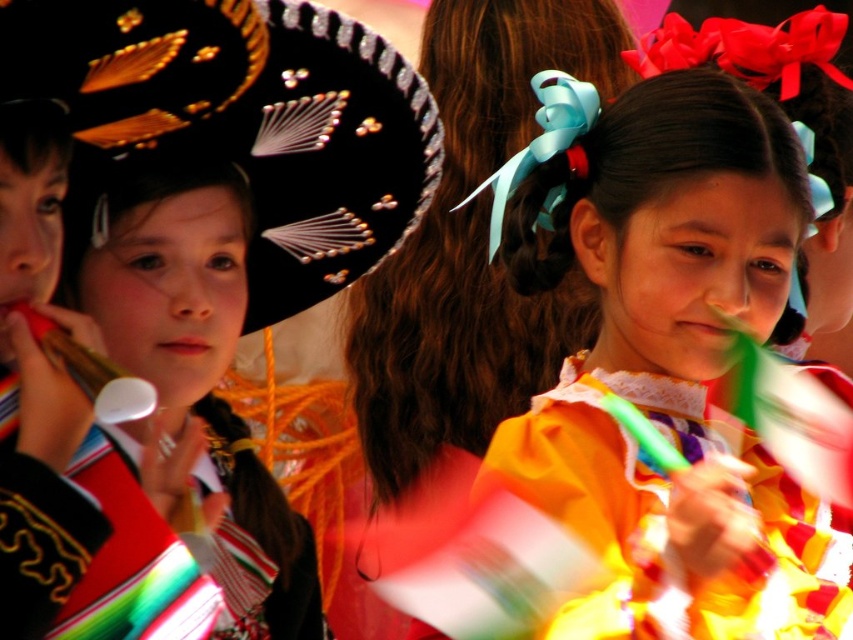
Question: Which of the following is the farthest from the observer?

Choices:
 (A) (112, 444)
 (B) (790, 502)
 (C) (76, 205)

Answer: (B)

Question: Which of the following is the closest to the observer?

Choices:
 (A) multicolored fabric at left
 (B) black satin sombrero at left
 (C) matte yellow dress at center

Answer: (B)

Question: Where is matte yellow dress at center located in relation to multicolored fabric at left in the image?

Choices:
 (A) above
 (B) below

Answer: (A)

Question: Does matte yellow dress at center have a smaller size compared to yellow satin dress at center?

Choices:
 (A) no
 (B) yes

Answer: (A)

Question: Can you confirm if yellow satin dress at center is positioned above multicolored fabric at left?

Choices:
 (A) yes
 (B) no

Answer: (A)

Question: Which object is farther from the camera taking this photo?

Choices:
 (A) matte yellow dress at center
 (B) black satin sombrero at left

Answer: (A)